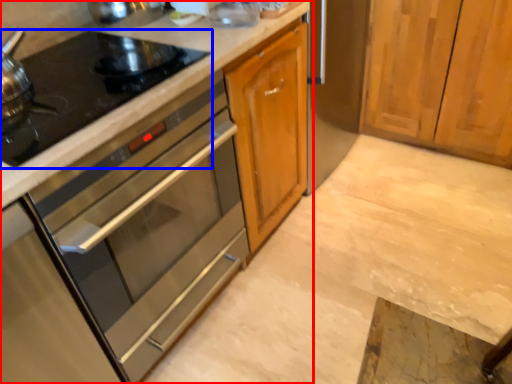
Question: Among these objects, which one is farthest to the camera, cabinetry (highlighted by a red box) or gas stove (highlighted by a blue box)?

Choices:
 (A) cabinetry
 (B) gas stove

Answer: (B)